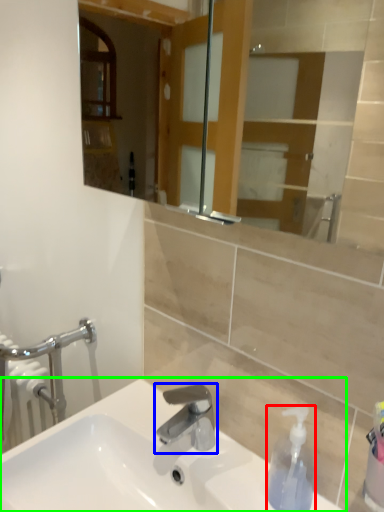
Question: Which object is the farthest from soap dispenser (highlighted by a red box)? Choose among these: tap (highlighted by a blue box) or sink (highlighted by a green box).

Choices:
 (A) tap
 (B) sink

Answer: (B)